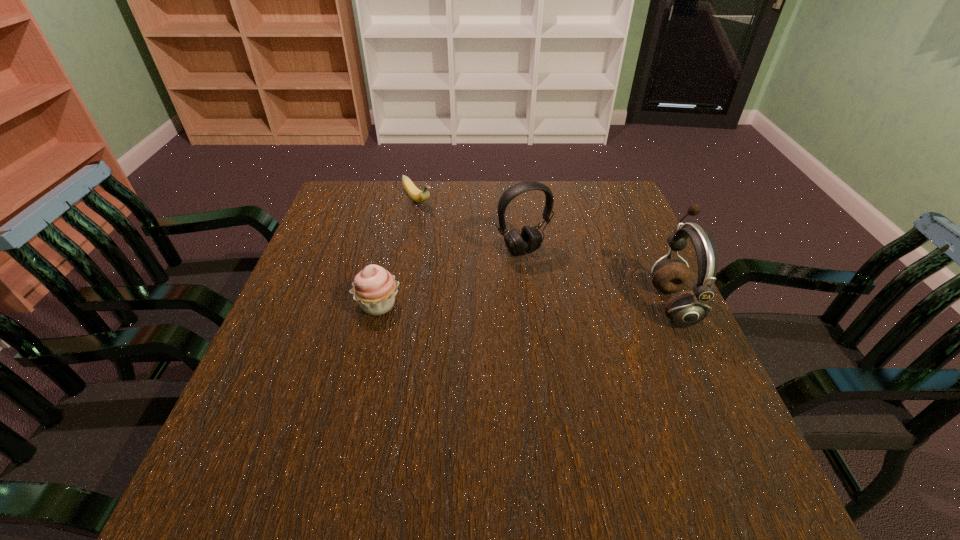
Where is `vacant space at the left edge of the desktop`? This screenshot has height=540, width=960. vacant space at the left edge of the desktop is located at coordinates (340, 353).

At what (x,y) coordinates should I click in order to perform the action: click on vacant space at the right edge of the desktop. Please return your answer as a coordinate pair (x, y). Image resolution: width=960 pixels, height=540 pixels. Looking at the image, I should click on (602, 272).

Find the location of a particular element. The image size is (960, 540). vacant space at the far left corner of the desktop is located at coordinates (384, 185).

In the image, there is a desktop. Where is `vacant region at the near right corner`? vacant region at the near right corner is located at coordinates (691, 414).

What are the coordinates of `vacant area that lies between the rightmost object and the second tallest object` in the screenshot? It's located at (x=597, y=277).

The image size is (960, 540). What are the coordinates of `vacant space that's between the cupcake and the farthest object` in the screenshot? It's located at (397, 253).

Find the location of `vacant space in between the shortest object and the earphone`. vacant space in between the shortest object and the earphone is located at coordinates (545, 252).

Identify the location of free spot between the shortest object and the cupcake. (397, 253).

Find the location of a particular element. The width and height of the screenshot is (960, 540). vacant space in between the third tallest object and the earphone is located at coordinates (525, 305).

This screenshot has width=960, height=540. Find the location of `vacant point located between the shortest object and the second object from right to left`. vacant point located between the shortest object and the second object from right to left is located at coordinates (470, 225).